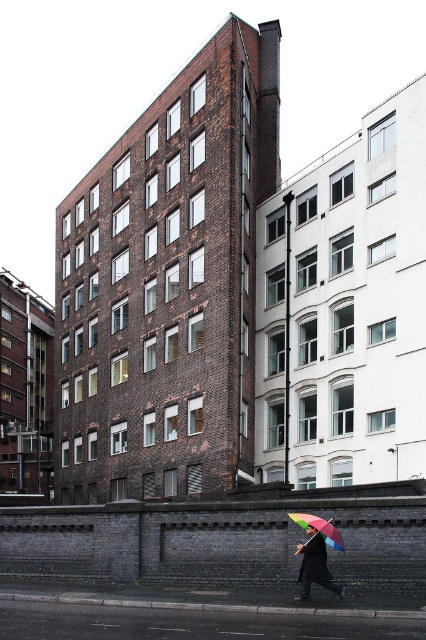
Identify the location of rainbow umbrella at lower center. [x=314, y=564].

Does rainbow umbrella at lower center appear on the left side of rainbow fabric umbrella at lower right?

Incorrect, rainbow umbrella at lower center is not on the left side of rainbow fabric umbrella at lower right.

Locate an element on the screen. Image resolution: width=426 pixels, height=640 pixels. rainbow umbrella at lower center is located at coordinates (314, 564).